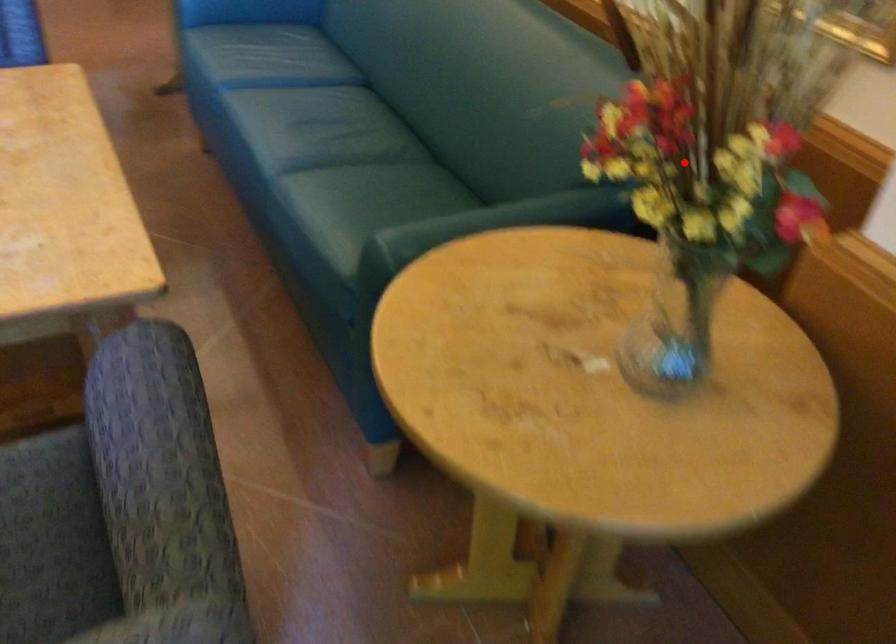
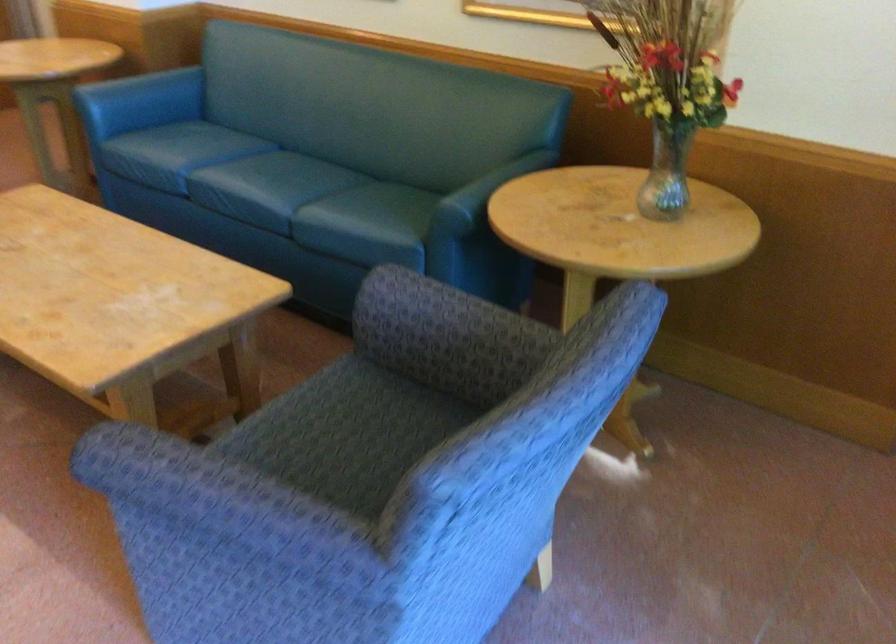
Question: I am providing you with two images of the same scene from different viewpoints. A red point is shown in image1. For the corresponding object point in image2, is it positioned nearer or farther from the camera?

Choices:
 (A) Nearer
 (B) Farther

Answer: (B)